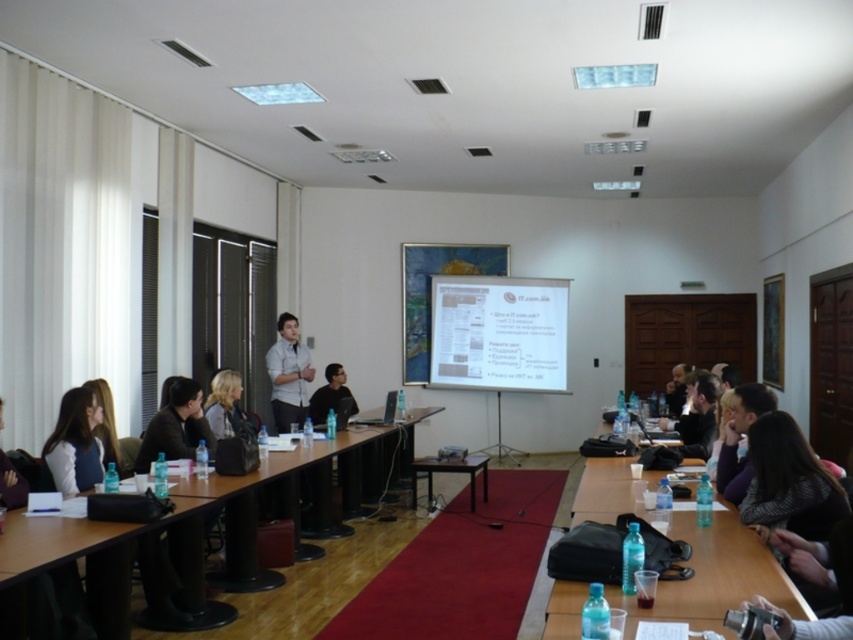
Is point (773, 488) closer to viewer compared to point (479, 468)?

Yes, point (773, 488) is in front of point (479, 468).

Does dark gray sweater at center come behind black matte table at center?

No, it is not.

Who is more forward, (819, 509) or (433, 456)?

Point (819, 509) is more forward.

Image resolution: width=853 pixels, height=640 pixels. I want to click on dark gray sweater at center, so click(787, 481).

Which is below, white fabric shirt at left or matte black jacket at center?

matte black jacket at center

Is point (96, 445) positioned behind point (189, 435)?

No, it is not.

Locate an element on the screen. The image size is (853, 640). white fabric shirt at left is located at coordinates (74, 444).

Is matte white shirt at center to the right of black matte table at center from the viewer's perspective?

In fact, matte white shirt at center is to the left of black matte table at center.

Where is `matte white shirt at center`? matte white shirt at center is located at coordinates (288, 374).